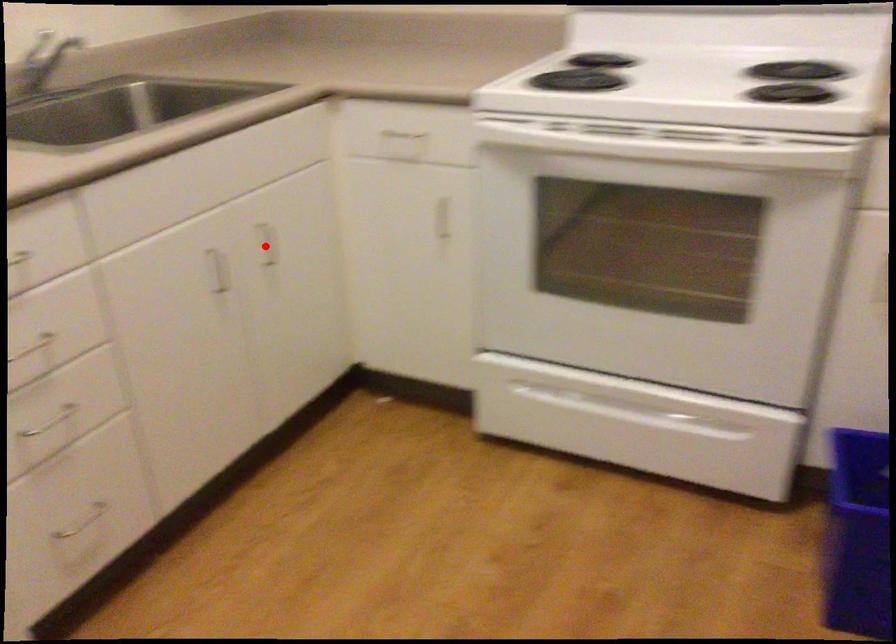
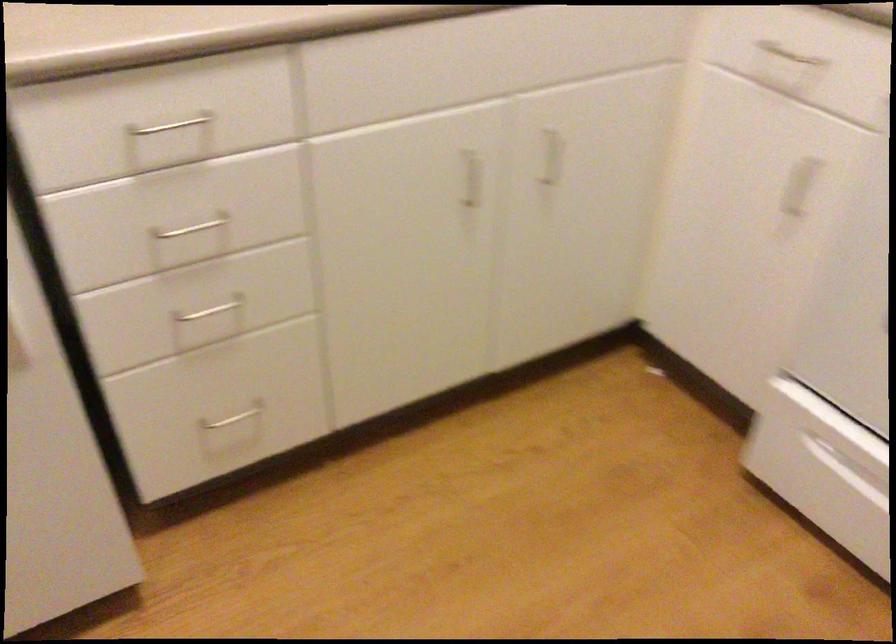
The point at the highlighted location is marked in the first image. Where is the corresponding point in the second image?

(552, 156)